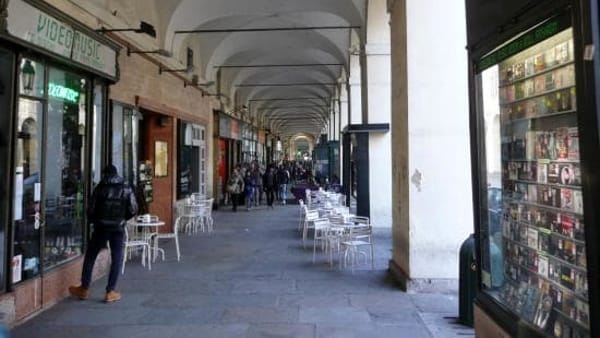
Identify the location of neon sign. pyautogui.click(x=58, y=86).